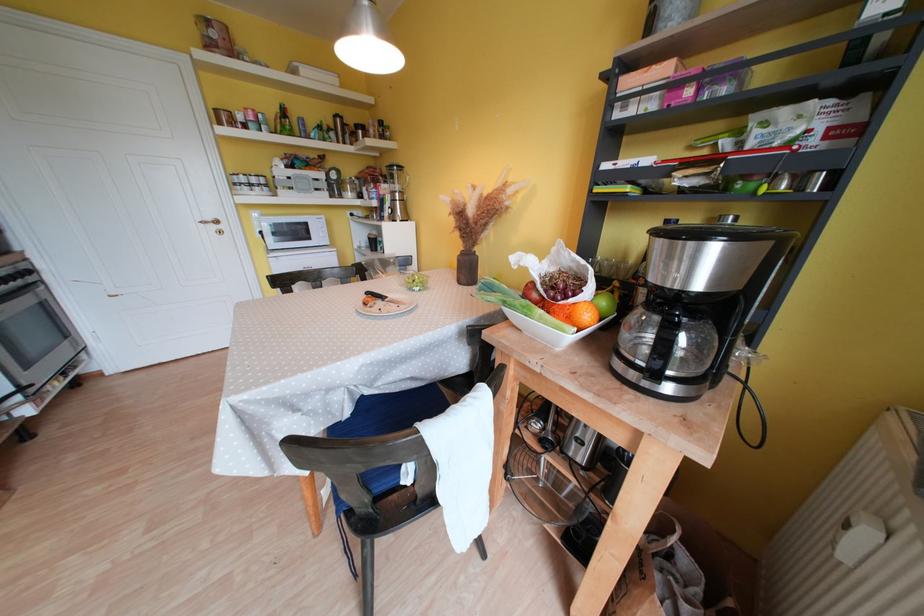
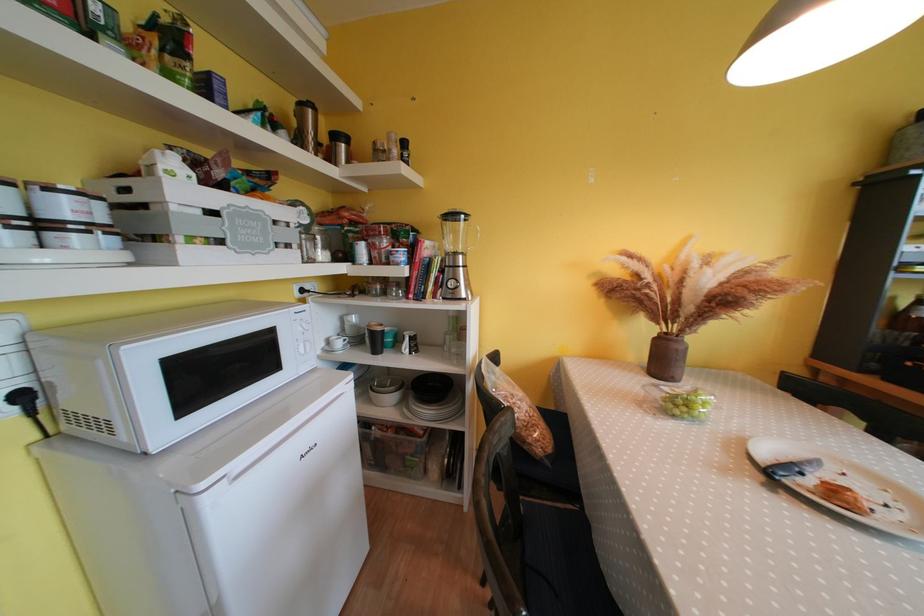
Locate, in the second image, the point that corresponds to point (342, 120) in the first image.

(308, 108)